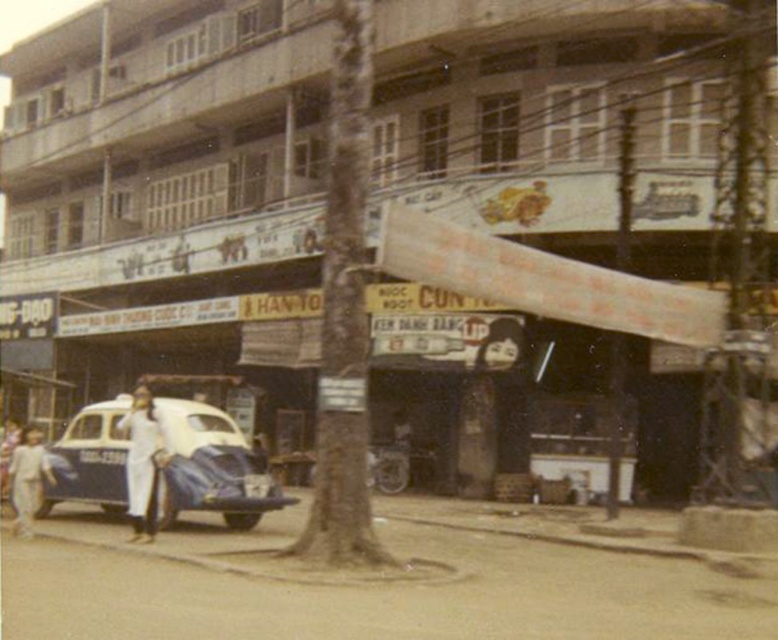
Question: Does dark hair at center appear over white clothed person at lower left?

Choices:
 (A) no
 (B) yes

Answer: (B)

Question: Which object is positioned farthest from the light beige pants at lower left?

Choices:
 (A) blue metallic taxi at lower left
 (B) white clothed person at center

Answer: (A)

Question: Which of the following is the farthest from the observer?

Choices:
 (A) light beige pants at lower left
 (B) blue metallic taxi at lower left
 (C) white clothed person at center

Answer: (A)

Question: Which object appears closest to the camera in this image?

Choices:
 (A) white clothed person at lower left
 (B) white clothed person at center
 (C) dark hair at center
 (D) blue metallic taxi at lower left

Answer: (B)

Question: Can you confirm if white clothed person at center is thinner than light beige pants at lower left?

Choices:
 (A) no
 (B) yes

Answer: (A)

Question: Can you confirm if blue metallic taxi at lower left is smaller than dark hair at center?

Choices:
 (A) no
 (B) yes

Answer: (A)